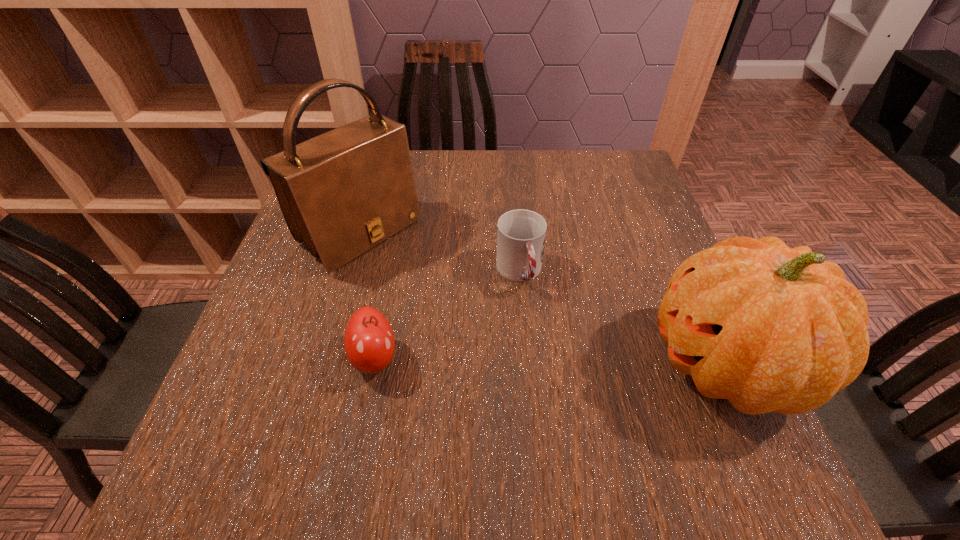
Where is `apple`? apple is located at coordinates (369, 342).

Find the location of a particular element. the rightmost object is located at coordinates (772, 329).

Locate an element on the screen. the third shortest object is located at coordinates (772, 329).

Image resolution: width=960 pixels, height=540 pixels. I want to click on cup, so click(521, 233).

At what (x,y) coordinates should I click in order to perform the action: click on the tallest object. Please return your answer as a coordinate pair (x, y). The image size is (960, 540). Looking at the image, I should click on (343, 192).

Where is `vacant area located on the back of the apple`? The width and height of the screenshot is (960, 540). vacant area located on the back of the apple is located at coordinates (391, 277).

The height and width of the screenshot is (540, 960). I want to click on vacant space located on the carved face of the pumpkin, so click(484, 364).

At what (x,y) coordinates should I click in order to perform the action: click on vacant position located 0.240m on the carved face of the pumpkin. Please return your answer as a coordinate pair (x, y). Looking at the image, I should click on (516, 364).

Locate an element on the screen. Image resolution: width=960 pixels, height=540 pixels. vacant region located 0.200m on the carved face of the pumpkin is located at coordinates (539, 364).

You are a GUI agent. You are given a task and a screenshot of the screen. Output one action in this format:
    pyautogui.click(x=<x>, y=<y>)
    Task: Click on the vacant region located on the handle side of the second object from right to left
    This screenshot has width=960, height=540.
    Given the screenshot: What is the action you would take?
    pyautogui.click(x=548, y=355)